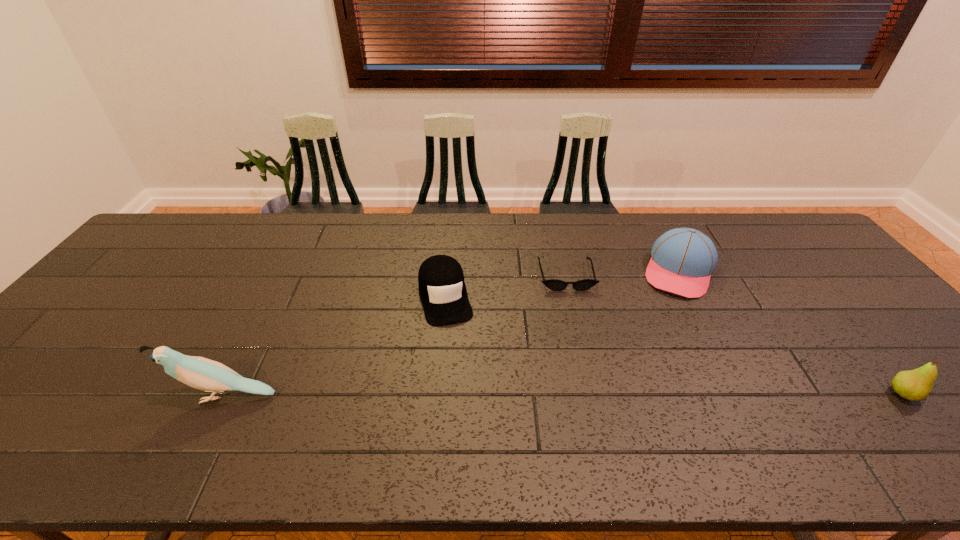
Locate an element on the screen. The image size is (960, 540). vacant space situated at the face of the leftmost object is located at coordinates click(130, 396).

Where is `free region located 0.380m on the left of the rightmost object`? free region located 0.380m on the left of the rightmost object is located at coordinates (724, 394).

Image resolution: width=960 pixels, height=540 pixels. Find the location of `free location located 0.310m on the front-facing side of the third object from right to left`. free location located 0.310m on the front-facing side of the third object from right to left is located at coordinates (590, 380).

Identify the location of blank space located on the front-facing side of the third object from right to left. (585, 356).

This screenshot has height=540, width=960. I want to click on vacant area situated on the front-facing side of the third object from right to left, so [x=576, y=319].

Locate an element on the screen. This screenshot has height=540, width=960. vacant space located on the front-facing side of the fourth object from left to right is located at coordinates (655, 364).

Locate an element on the screen. Image resolution: width=960 pixels, height=540 pixels. vacant space located on the front-facing side of the fourth object from left to right is located at coordinates (660, 348).

I want to click on vacant space located on the front-facing side of the fourth object from left to right, so click(667, 322).

Where is `vacant space located 0.170m on the front-facing side of the cap`? vacant space located 0.170m on the front-facing side of the cap is located at coordinates (463, 377).

Image resolution: width=960 pixels, height=540 pixels. I want to click on free spot located on the front-facing side of the cap, so click(459, 364).